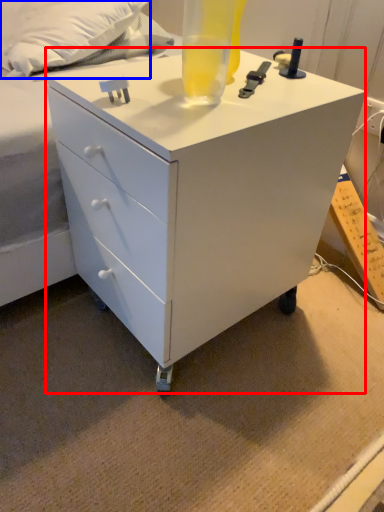
Question: Which of the following is the farthest to the observer, chest of drawers (highlighted by a red box) or pillow (highlighted by a blue box)?

Choices:
 (A) chest of drawers
 (B) pillow

Answer: (B)